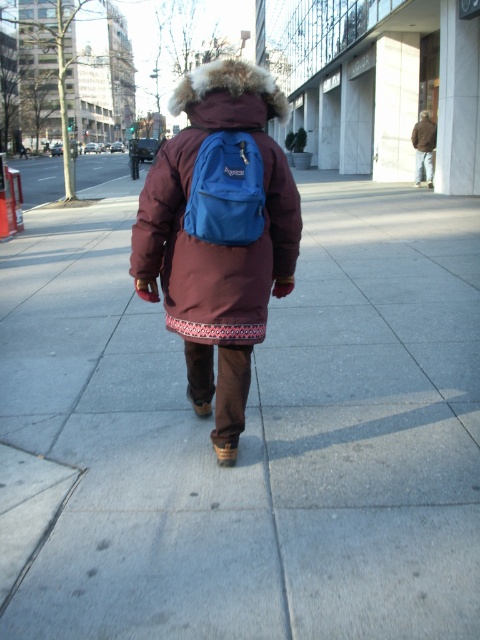
Question: Based on their relative distances, which object is farther from the maroon fur-lined coat at center?

Choices:
 (A) matte blue backpack at center
 (B) gray concrete sidewalk at center

Answer: (B)

Question: Does maroon fur-lined coat at center have a greater width compared to matte blue backpack at center?

Choices:
 (A) no
 (B) yes

Answer: (B)

Question: Can you confirm if gray concrete sidewalk at center is positioned below matte blue backpack at center?

Choices:
 (A) no
 (B) yes

Answer: (A)

Question: Among these points, which one is farthest from the camera?

Choices:
 (A) (262, 294)
 (B) (420, 490)
 (C) (208, 225)

Answer: (A)

Question: Estimate the real-world distances between objects in this image. Which object is farther from the maroon fur-lined coat at center?

Choices:
 (A) matte blue backpack at center
 (B) gray concrete sidewalk at center

Answer: (B)

Question: Is gray concrete sidewalk at center thinner than maroon fur-lined coat at center?

Choices:
 (A) yes
 (B) no

Answer: (B)